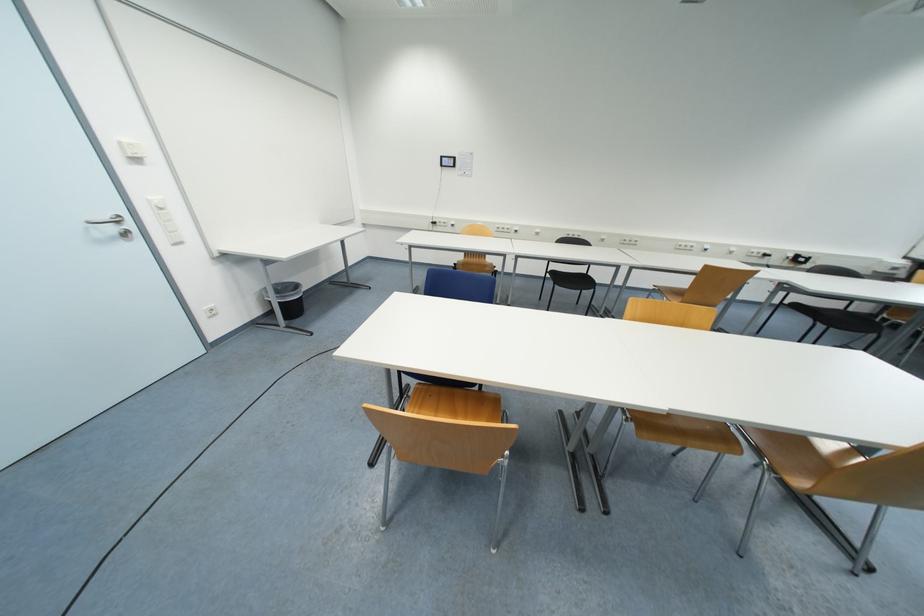
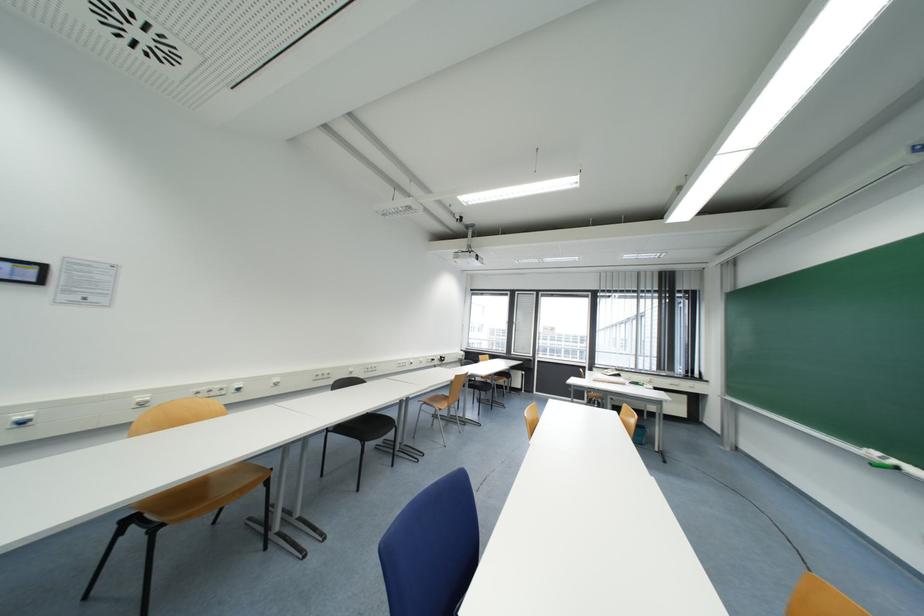
Find the pixel in the second image that matches (457,227) in the first image.

(28, 424)